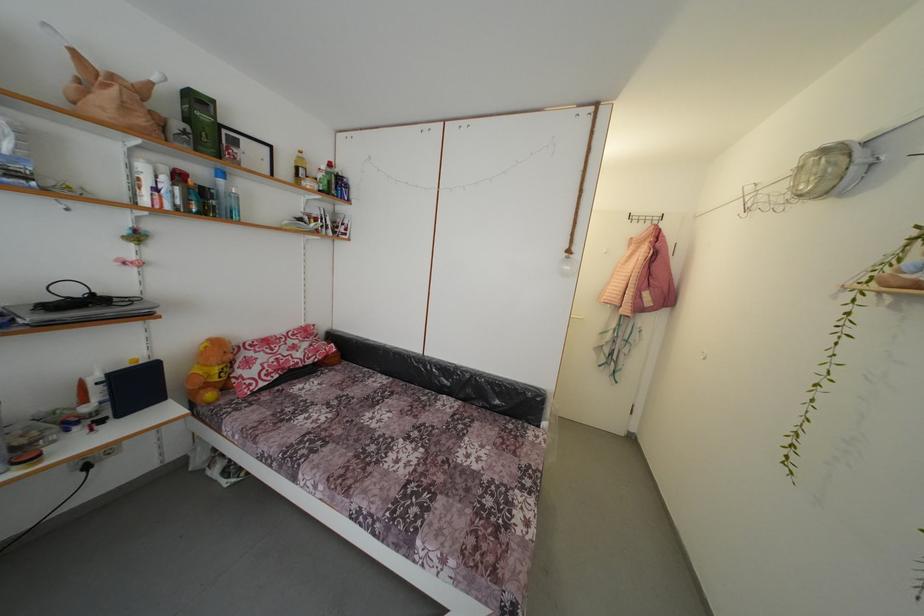
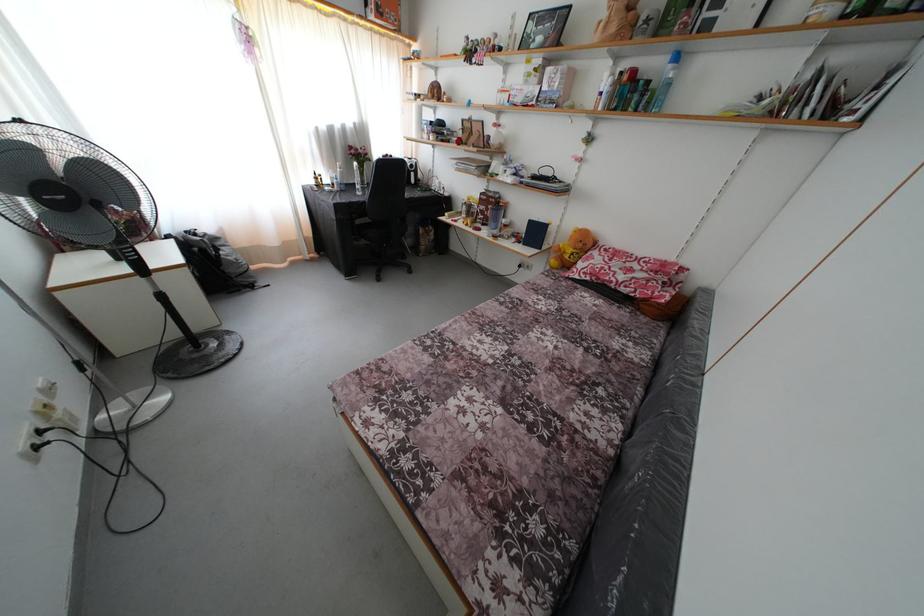
Locate, in the second image, the point that corresponds to point (236, 362) in the first image.

(585, 251)